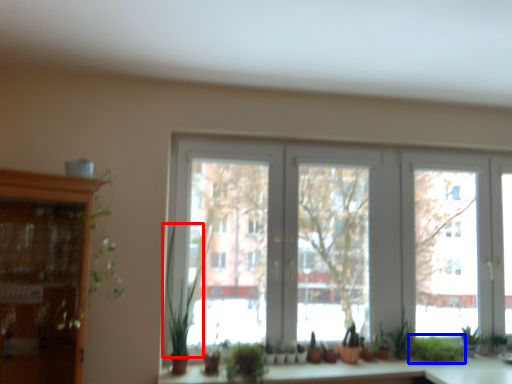
Question: Which point is closer to the camera, plant (highlighted by a red box) or plant (highlighted by a blue box)?

Choices:
 (A) plant
 (B) plant

Answer: (A)